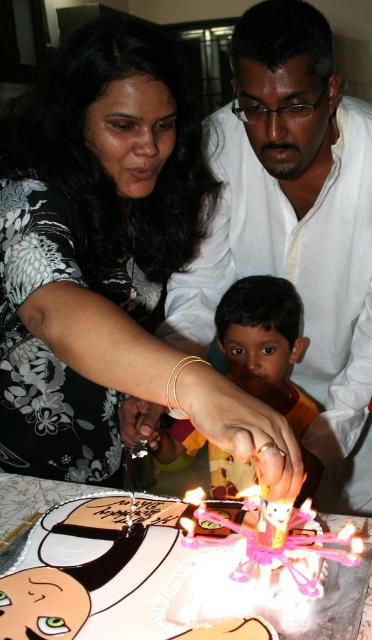
Question: Is orange fabric shirt at center wider than pink wax candle at center?

Choices:
 (A) no
 (B) yes

Answer: (B)

Question: Which point is farther to the camera?

Choices:
 (A) floral-patterned dress at center
 (B) pink wax candle at center

Answer: (B)

Question: From the image, what is the correct spatial relationship of orange fabric shirt at center in relation to pink wax candle at center?

Choices:
 (A) below
 (B) above

Answer: (B)

Question: Which point is closer to the camera taking this photo?

Choices:
 (A) (257, 257)
 (B) (18, 384)
 (C) (183, 525)

Answer: (C)

Question: Is white matte shirt at center wider than pink wax candle at center?

Choices:
 (A) yes
 (B) no

Answer: (A)

Question: Considering the real-world distances, which object is farthest from the floral-patterned dress at center?

Choices:
 (A) orange fabric shirt at center
 (B) white matte shirt at center
 (C) pink wax candle at center
 (D) white fondant cake with pink candles at center

Answer: (C)